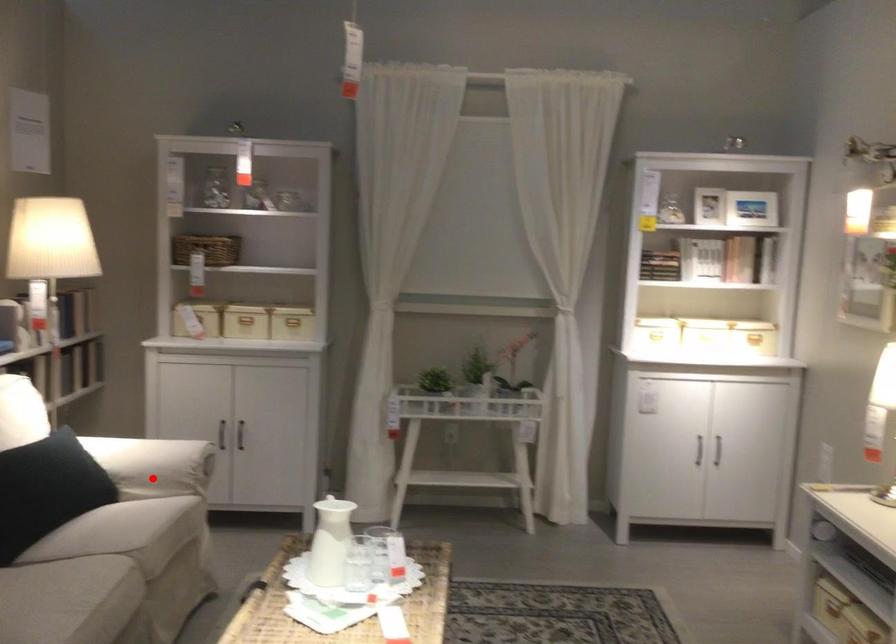
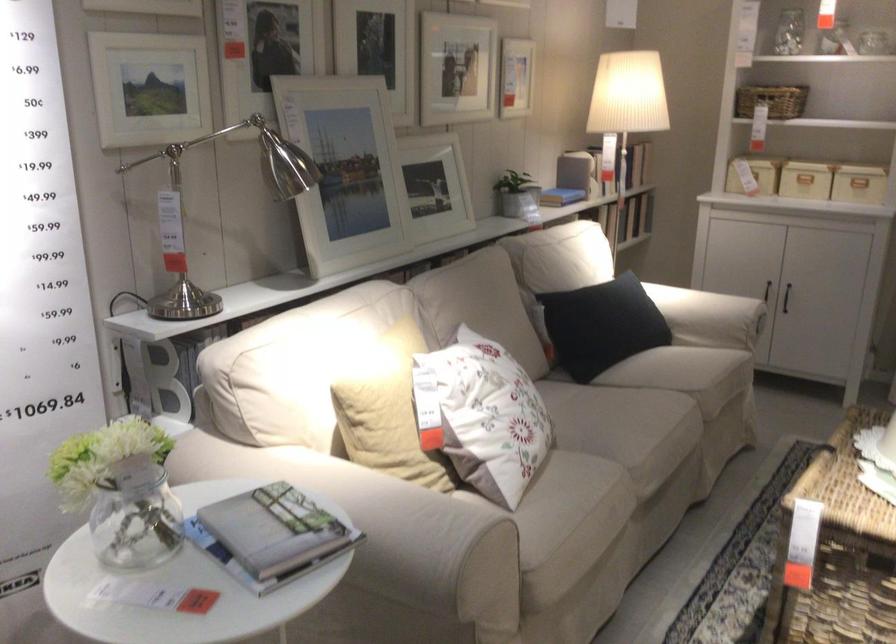
Where in the second image is the point corresponding to the highlighted location from the first image?

(709, 317)